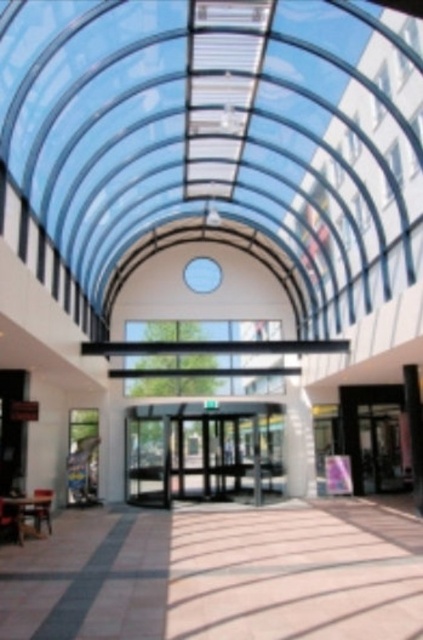
Question: Estimate the real-world distances between objects in this image. Which object is farther from the transparent glass doors at center?

Choices:
 (A) smooth white pillar at right
 (B) glass door at center

Answer: (A)

Question: Which object appears closest to the camera in this image?

Choices:
 (A) smooth white pillar at right
 (B) glass door at center

Answer: (A)

Question: Is transparent glass doors at center further to camera compared to smooth white pillar at right?

Choices:
 (A) no
 (B) yes

Answer: (B)

Question: Based on their relative distances, which object is farther from the smooth white pillar at right?

Choices:
 (A) glass door at center
 (B) transparent glass doors at center

Answer: (B)

Question: Can you confirm if glass door at center is positioned above smooth white pillar at right?

Choices:
 (A) yes
 (B) no

Answer: (B)

Question: Can you confirm if transparent glass doors at center is wider than glass door at center?

Choices:
 (A) no
 (B) yes

Answer: (A)